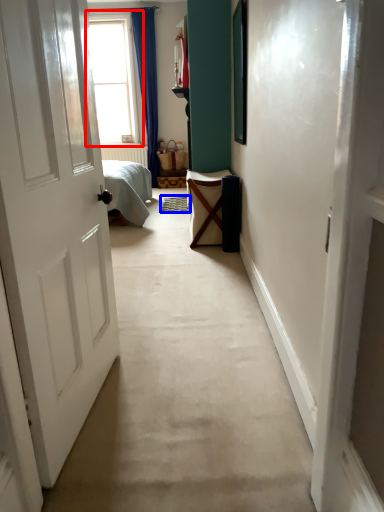
Question: Which of the following is the closest to the observer, window (highlighted by a red box) or doormat (highlighted by a blue box)?

Choices:
 (A) window
 (B) doormat

Answer: (B)